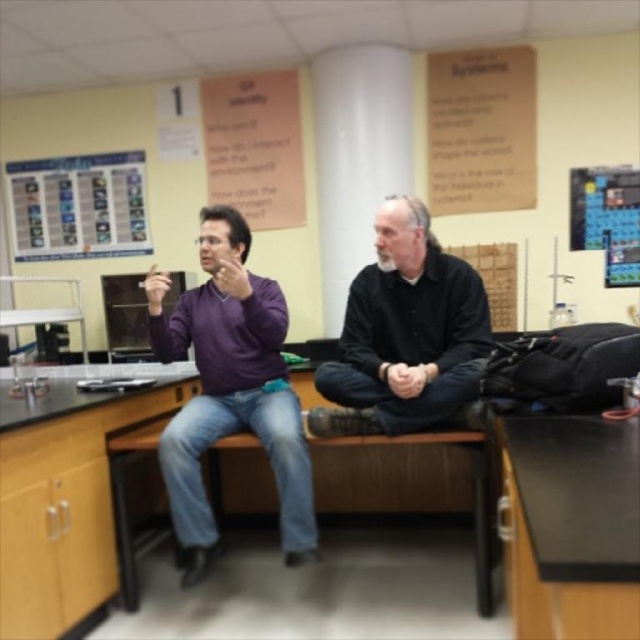
Question: Is black matte shirt at center to the right of black laminate counter top at center from the viewer's perspective?

Choices:
 (A) no
 (B) yes

Answer: (B)

Question: Is metallic silver chart at upper left below black laminate counter top at center?

Choices:
 (A) yes
 (B) no

Answer: (B)

Question: Among these objects, which one is nearest to the camera?

Choices:
 (A) black matte table at lower right
 (B) black matte shirt at center
 (C) purple matte sweater at left

Answer: (A)

Question: Which object is the farthest from the purple matte sweater at left?

Choices:
 (A) black laminate counter top at center
 (B) black matte table at lower right
 (C) metallic silver chart at upper left
 (D) black matte shirt at center

Answer: (C)

Question: Can you confirm if black matte shirt at center is thinner than metallic silver chart at upper left?

Choices:
 (A) yes
 (B) no

Answer: (A)

Question: Which is nearer to the purple matte sweater at left?

Choices:
 (A) black matte table at lower right
 (B) metallic silver chart at upper left
 (C) black matte shirt at center

Answer: (C)